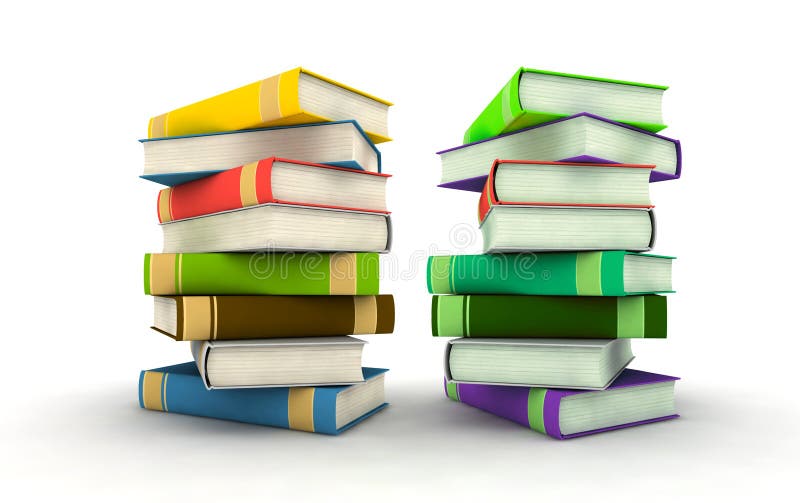
At what (x,y) coordinates should I click in order to perform the action: click on books in right stack. Please return your answer as a coordinate pair (x, y). This screenshot has width=800, height=503. Looking at the image, I should click on (557, 372), (561, 411), (558, 309), (572, 279), (574, 236), (568, 198), (576, 146), (566, 97).